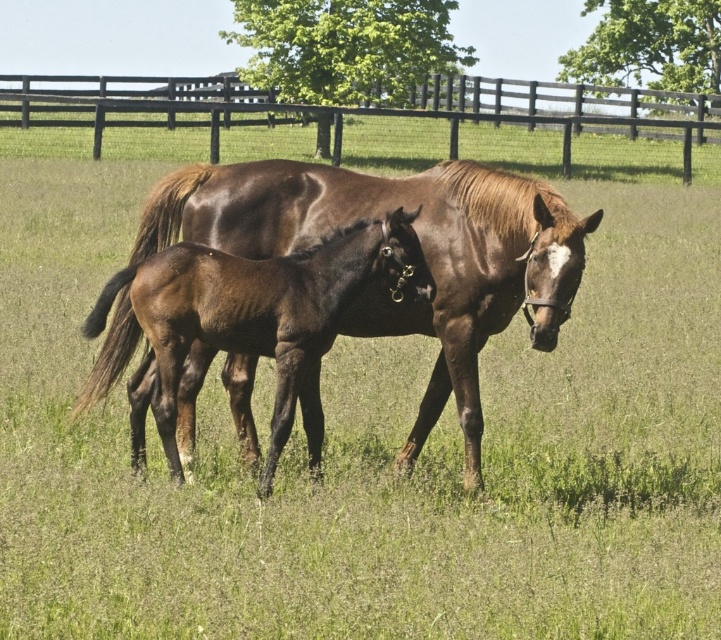
You are a photographer trying to capture a clear photo of the brown glossy horse at center without the brown wooden fence at upper center appearing in the background. Is this possible based on their positions?

The brown glossy horse at center is in front of the brown wooden fence at upper center, so the fence will be visible in the background of the photo.

You are a photographer standing in the field. You want to take a photo of the brown glossy horse at center and the brown wooden fence at upper center. Based on their positions, which object is closer to the ground?

The brown glossy horse at center is closer to the ground because it is positioned below the brown wooden fence at upper center.

Looking at this image, you are a photographer standing at the camera position. You want to capture a closeup of the brown glossy horse at center. Your camera has a minimum focusing distance of 5 meters. Can you take the photo without moving closer?

The brown glossy horse at center and camera are 6.12 meters apart. Since the minimum focusing distance is 5 meters, the photographer can take the closeup without moving closer because the distance is sufficient.